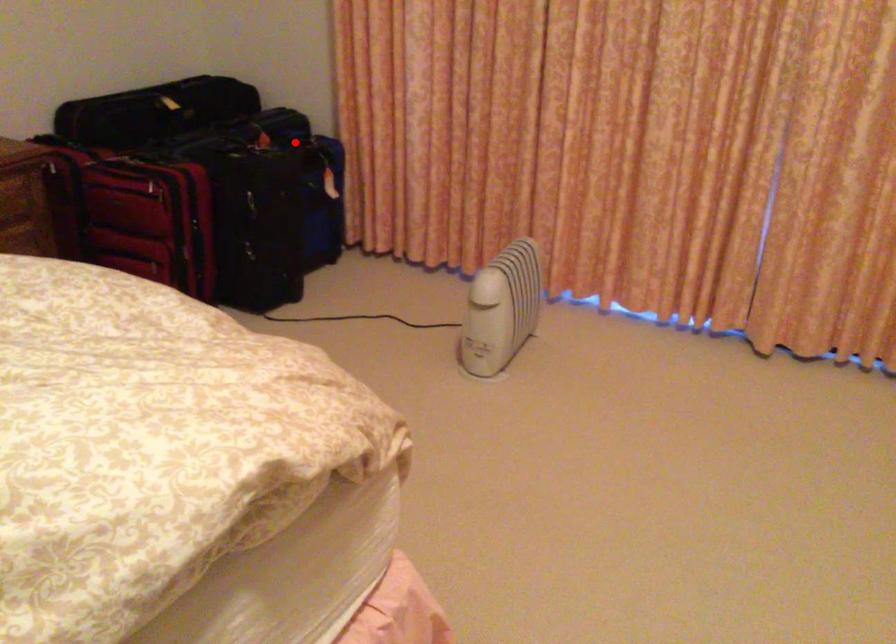
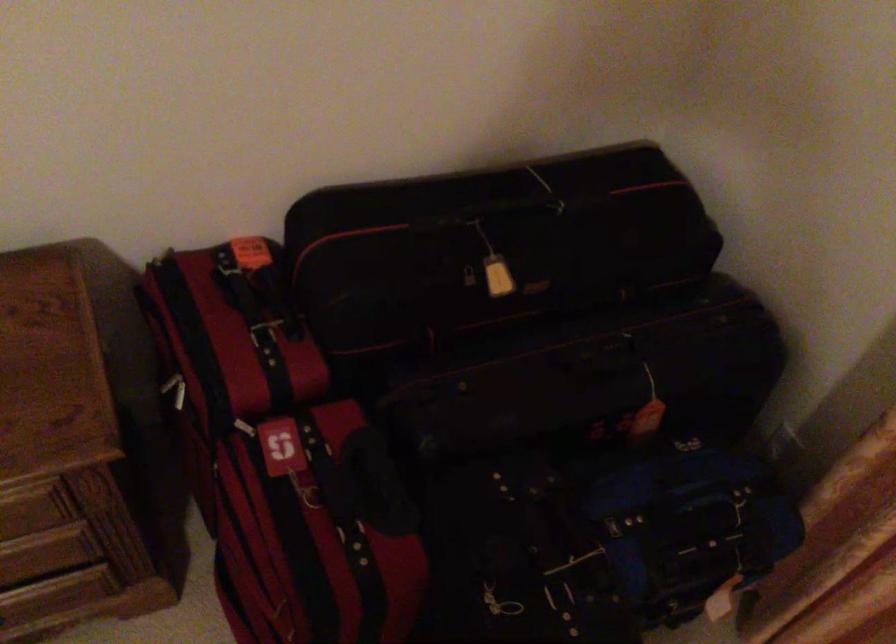
Where in the second image is the point corresponding to the highlighted location from the first image?

(676, 507)